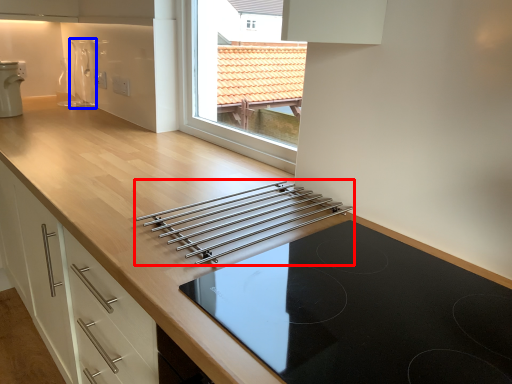
Question: Which object is closer to the camera taking this photo, kitchen appliance (highlighted by a red box) or appliance (highlighted by a blue box)?

Choices:
 (A) kitchen appliance
 (B) appliance

Answer: (A)